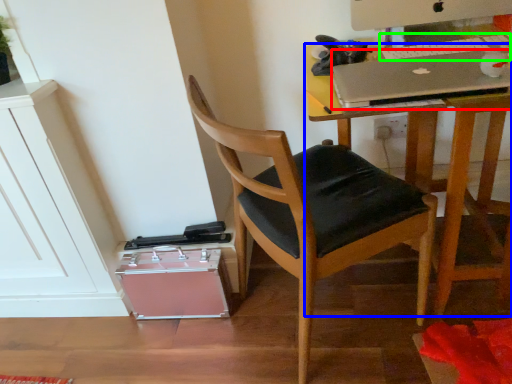
Question: Based on their relative distances, which object is farther from laptop (highlighted by a red box)? Choose from desk (highlighted by a blue box) and laptop keyboard (highlighted by a green box).

Choices:
 (A) desk
 (B) laptop keyboard

Answer: (A)